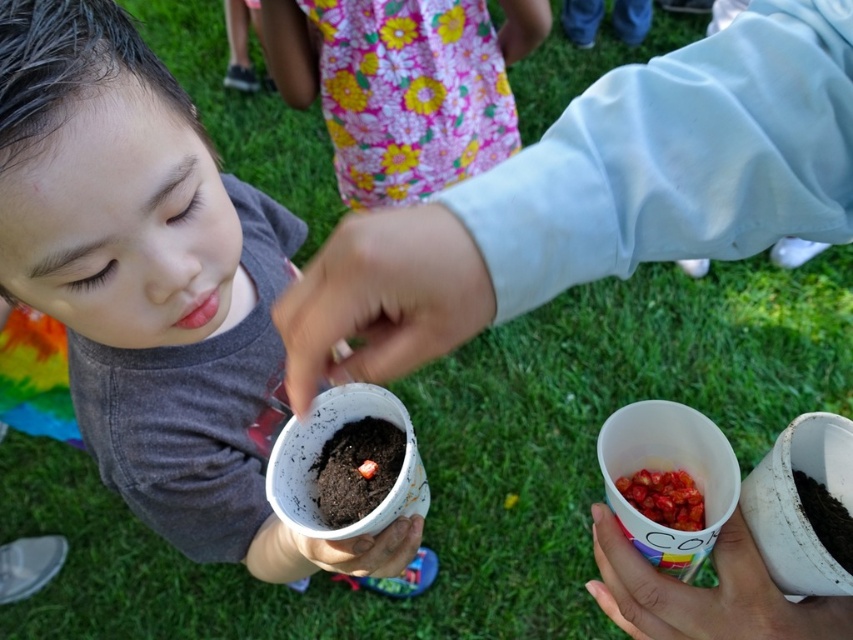
You are a photographer taking a picture of a child gardening. The child is wearing a matte gray shirt at center and has smooth skin at center. Which part of the child is visible higher in the photo?

The matte gray shirt at center is above smooth skin at center, so the matte gray shirt at center is visible higher in the photo.

You are a photographer trying to capture the scene where the matte gray shirt at center and the brown soil seed at center are both visible. Based on their positions, which object should appear first if you move your camera from left to right?

The matte gray shirt at center should appear first when moving the camera from left to right because it is positioned to the left of the brown soil seed at center.